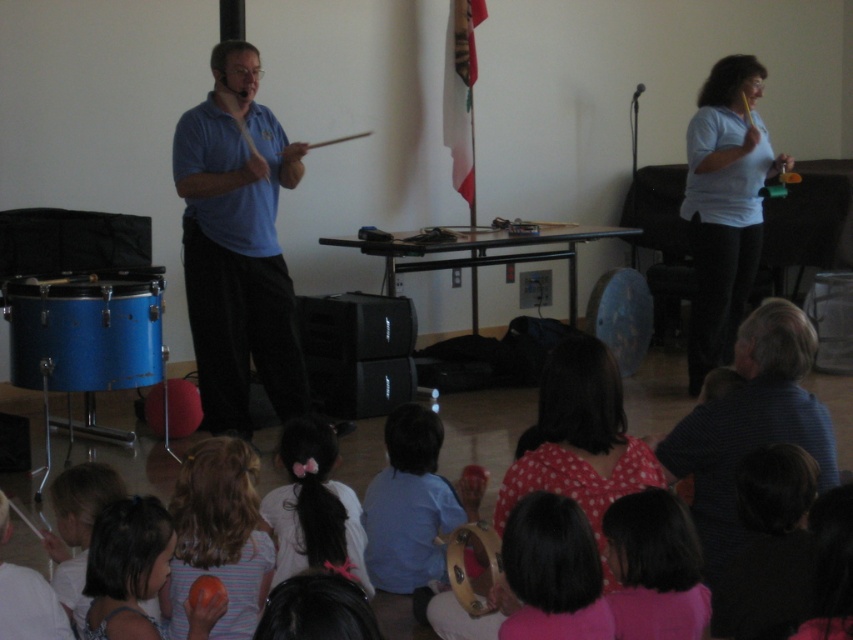
Question: Does pink fabric at lower right come behind pink hairband at center?

Choices:
 (A) no
 (B) yes

Answer: (A)

Question: Does matte blue shirt at center appear under pink hairband at center?

Choices:
 (A) yes
 (B) no

Answer: (B)

Question: Among these points, which one is farthest from the camera?

Choices:
 (A) (422, 544)
 (B) (511, 525)
 (C) (758, 168)

Answer: (C)

Question: Which point is farther to the camera?

Choices:
 (A) (450, 484)
 (B) (578, 556)
 (C) (596, 380)
 (D) (331, 532)

Answer: (A)

Question: Can you confirm if blue metallic drum at lower left is positioned to the right of blue fabric shirt at center?

Choices:
 (A) no
 (B) yes

Answer: (A)

Question: Which object is positioned closest to the pink fabric at lower right?

Choices:
 (A) polka dot fabric dress at center
 (B) dark blue striped shirt at lower right
 (C) pink hairband at center

Answer: (A)